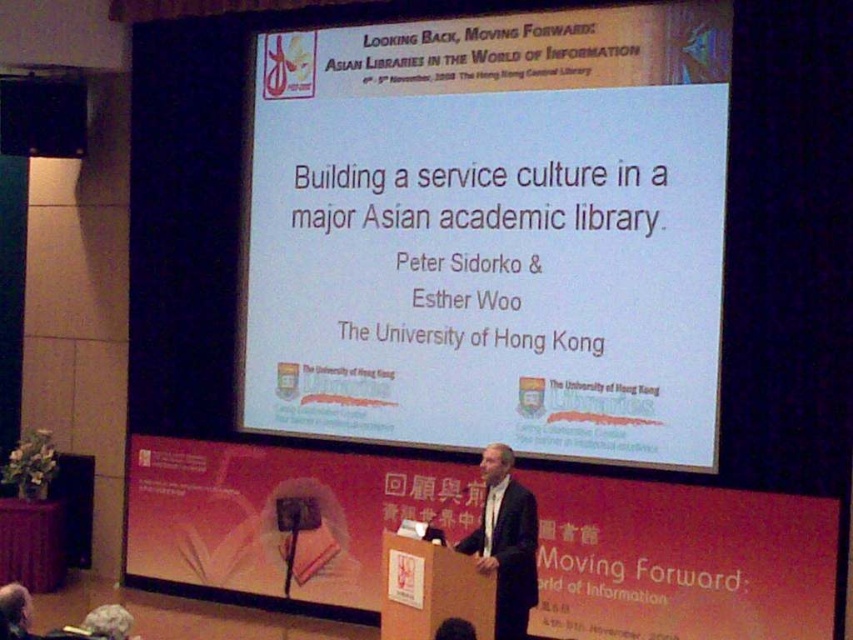
Is white paper at center positioned before dark gray wool suit at center?

No, it is behind dark gray wool suit at center.

Can you confirm if white paper at center is smaller than dark gray wool suit at center?

No.

Who is more forward, (585, 285) or (531, 596)?

Point (531, 596)

Locate an element on the screen. Image resolution: width=853 pixels, height=640 pixels. white paper at center is located at coordinates (491, 234).